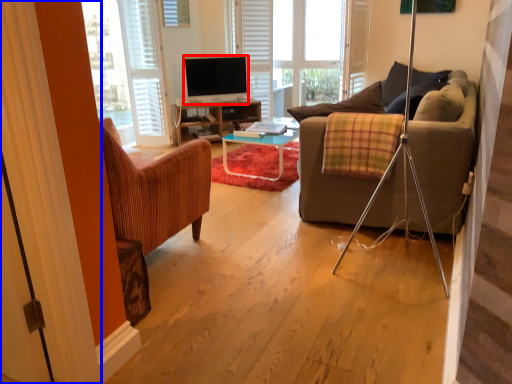
Question: Among these objects, which one is farthest to the camera, television (highlighted by a red box) or curtain (highlighted by a blue box)?

Choices:
 (A) television
 (B) curtain

Answer: (A)